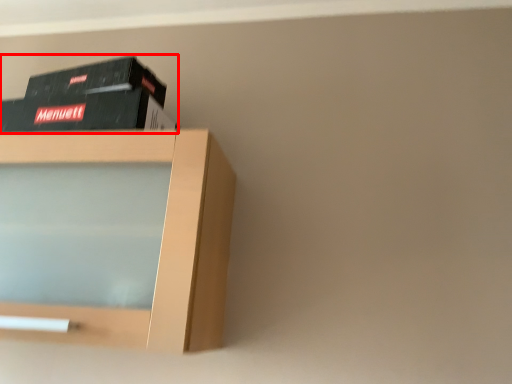
Question: From the image's perspective, where is book (annotated by the red box) located in relation to shelf in the image?

Choices:
 (A) below
 (B) above

Answer: (B)